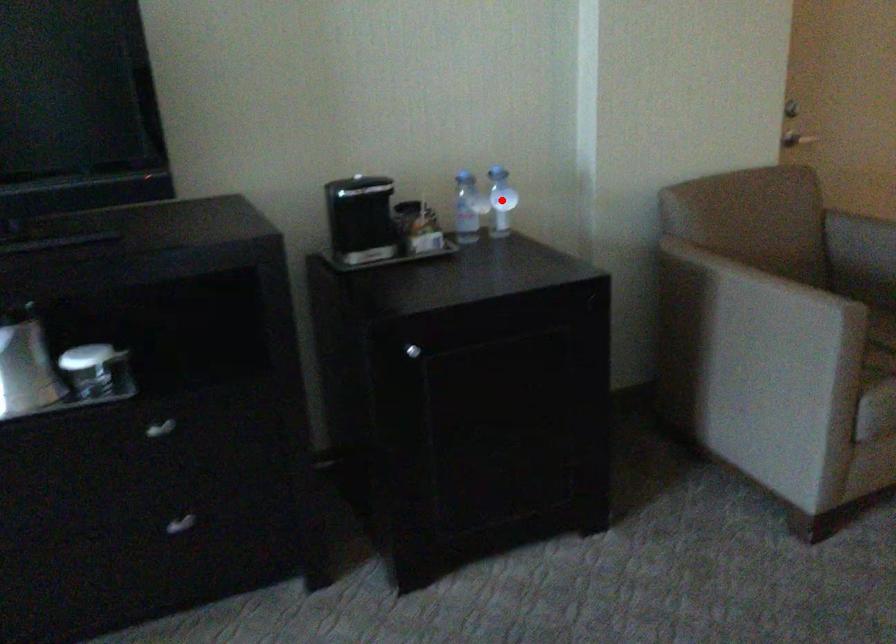
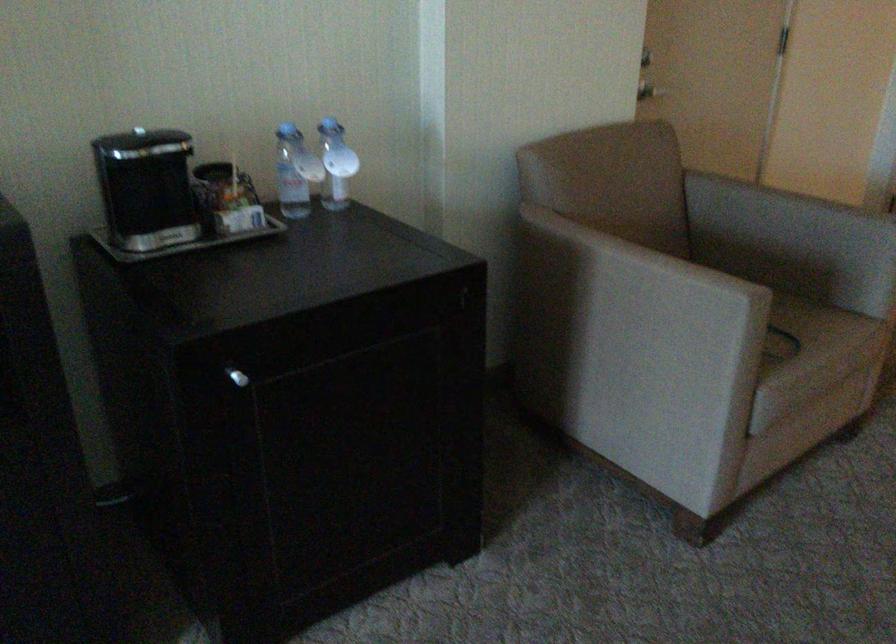
Question: I am providing you with two images of the same scene from different viewpoints. Given a red point in image1, look at the same physical point in image2. Is it:

Choices:
 (A) Closer to the viewpoint
 (B) Farther from the viewpoint

Answer: (A)